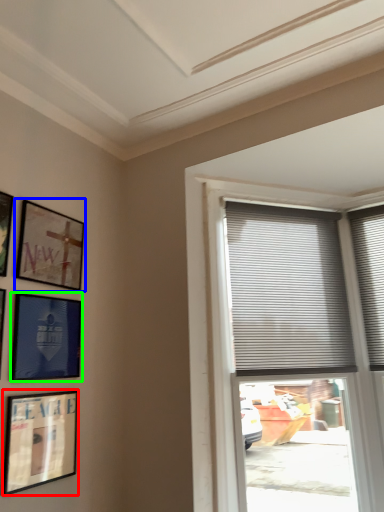
Question: Which object is positioned closest to picture frame (highlighted by a red box)? Select from picture frame (highlighted by a blue box) and picture frame (highlighted by a green box).

Choices:
 (A) picture frame
 (B) picture frame

Answer: (B)